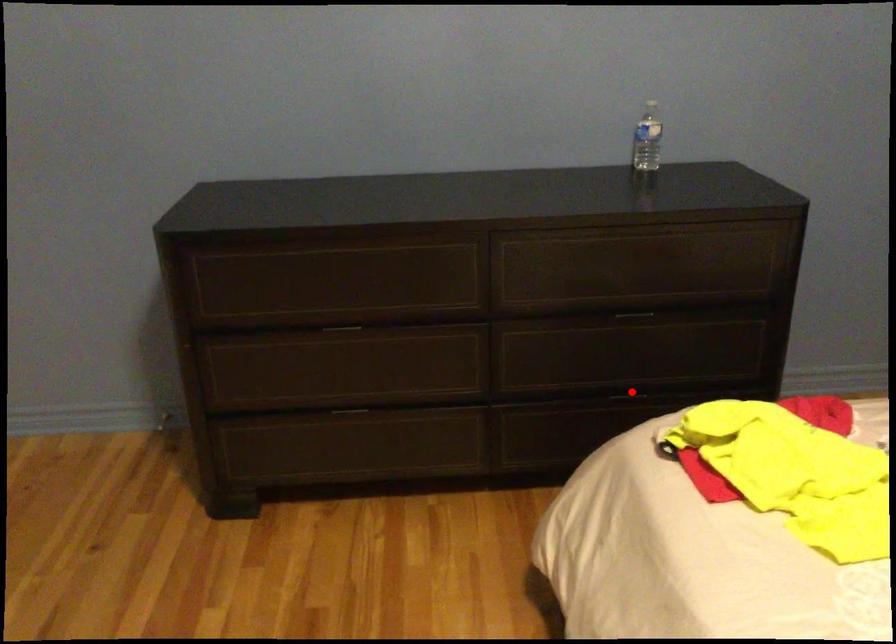
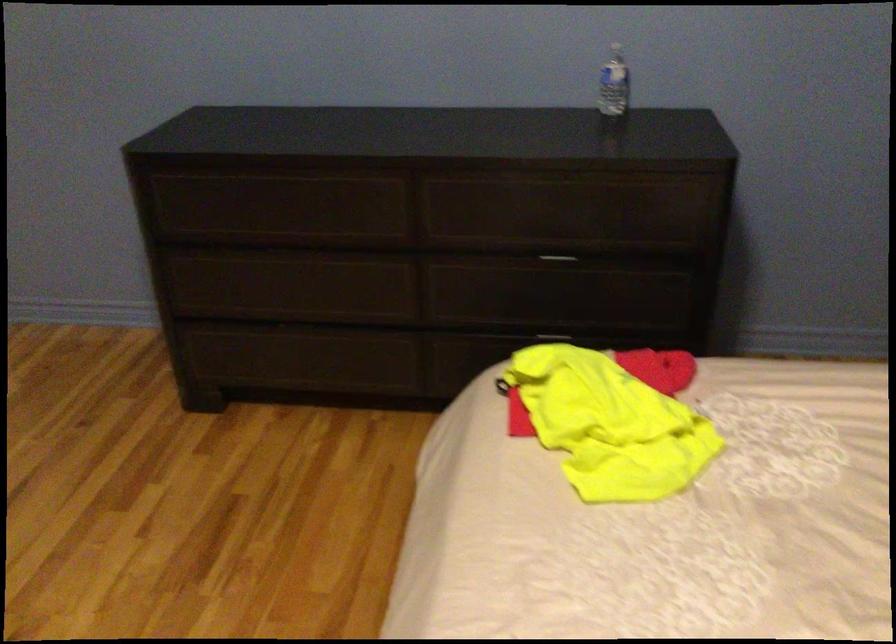
The point at the highlighted location is marked in the first image. Where is the corresponding point in the second image?

(553, 333)